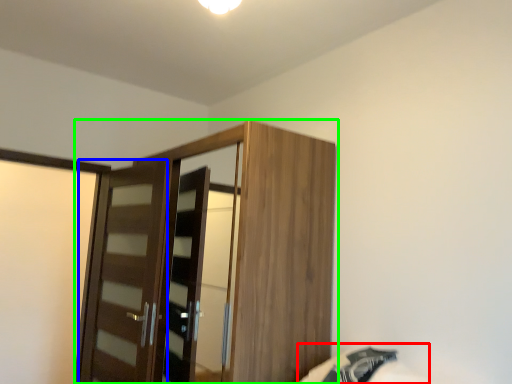
Question: Which object is the farthest from bed (highlighted by a red box)? Choose among these: door (highlighted by a blue box) or cupboard (highlighted by a green box).

Choices:
 (A) door
 (B) cupboard

Answer: (A)